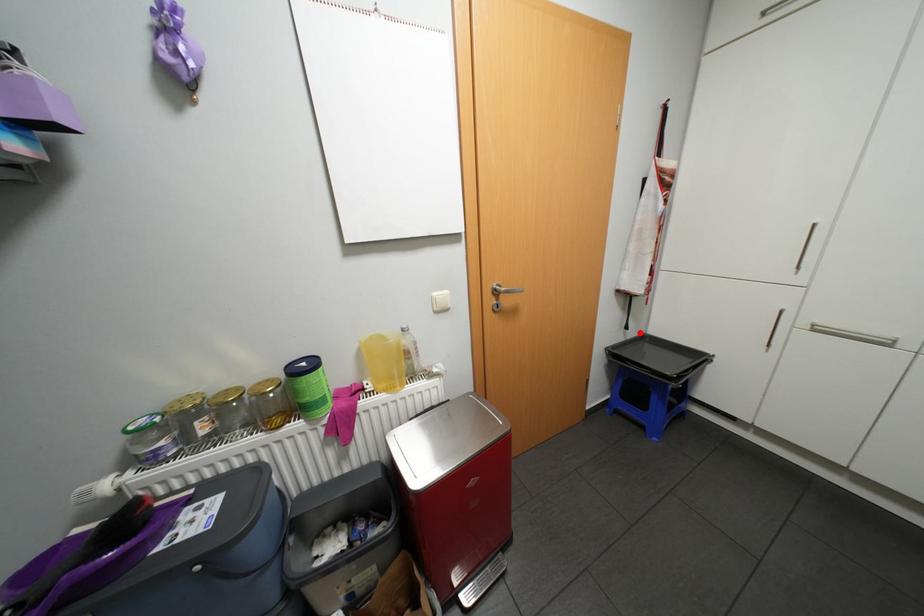
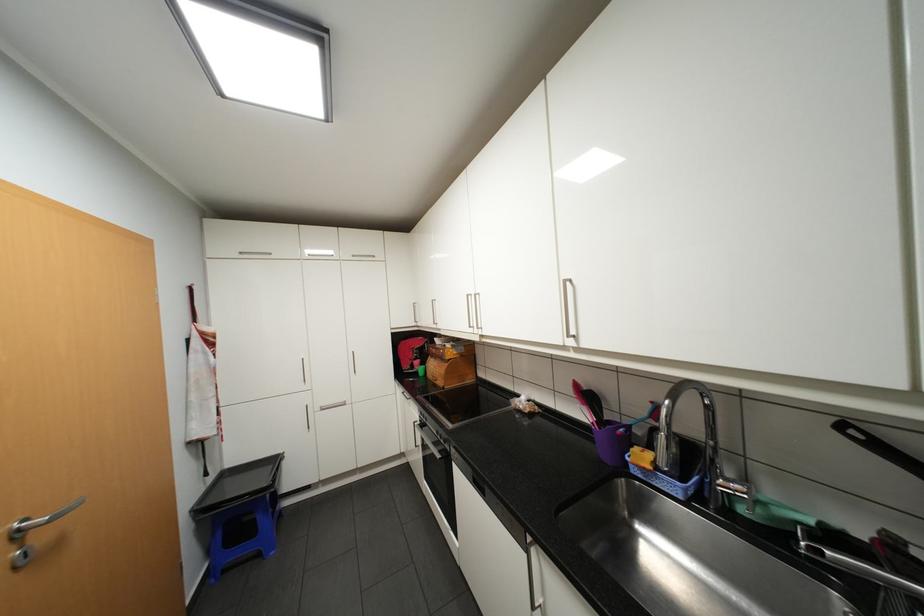
Question: I am providing you with two images of the same scene from different viewpoints. Given a red point in image1, look at the same physical point in image2. Is it:

Choices:
 (A) Closer to the viewpoint
 (B) Farther from the viewpoint

Answer: (A)